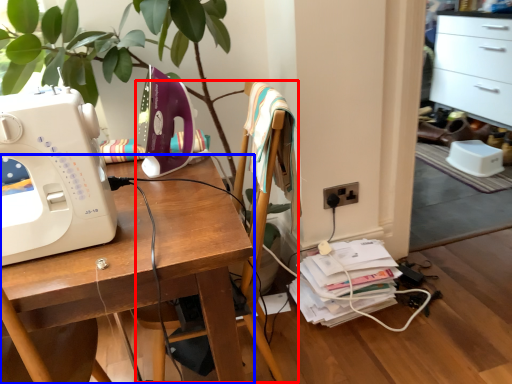
Question: Which of the following is the farthest to the observer, chair (highlighted by a red box) or desk (highlighted by a blue box)?

Choices:
 (A) chair
 (B) desk

Answer: (A)